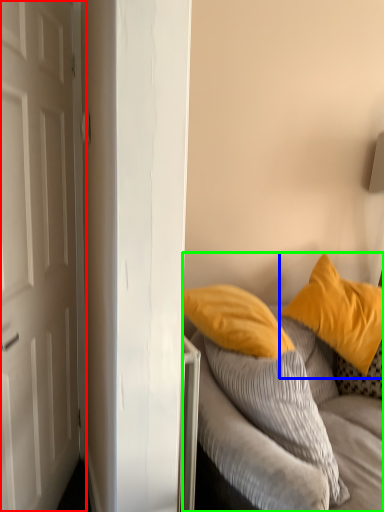
Question: Based on their relative distances, which object is farther from door (highlighted by a red box)? Choose from pillow (highlighted by a blue box) and studio couch (highlighted by a green box).

Choices:
 (A) pillow
 (B) studio couch

Answer: (A)